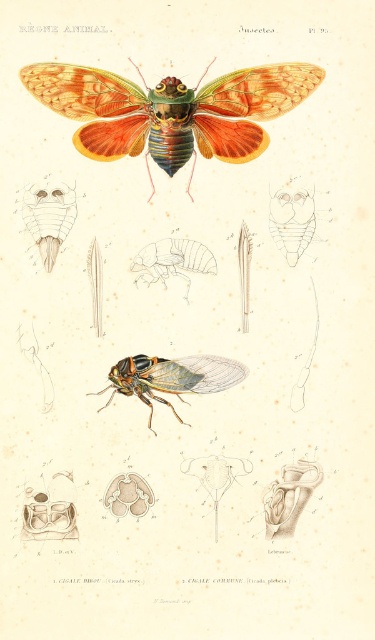
You are an entomologist examining the botanical illustration of a cicada. You need to determine if a 3.5 feet long measuring tool can reach from the camera to the point labeled point (x=102, y=152). Can it?

The distance between the camera and point (x=102, y=152) is 3.85 feet, which is longer than the 3.5 feet measuring tool. Therefore, the tool cannot reach that point.

According to the illustration, where is the shiny metallic cicada at upper center located in terms of coordinates?

The shiny metallic cicada at upper center is located at coordinates point (172, 109).